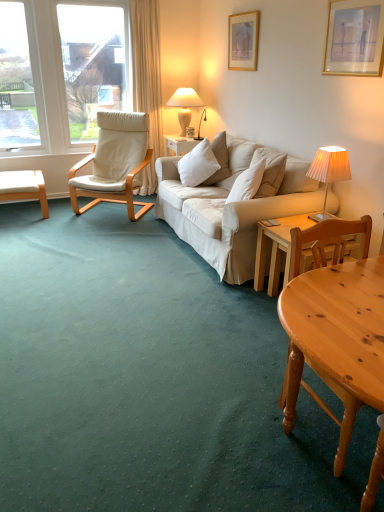
Where is `free point below light brown wooden table at lower right (from a real-world perspective)`? free point below light brown wooden table at lower right (from a real-world perspective) is located at coordinates (336, 438).